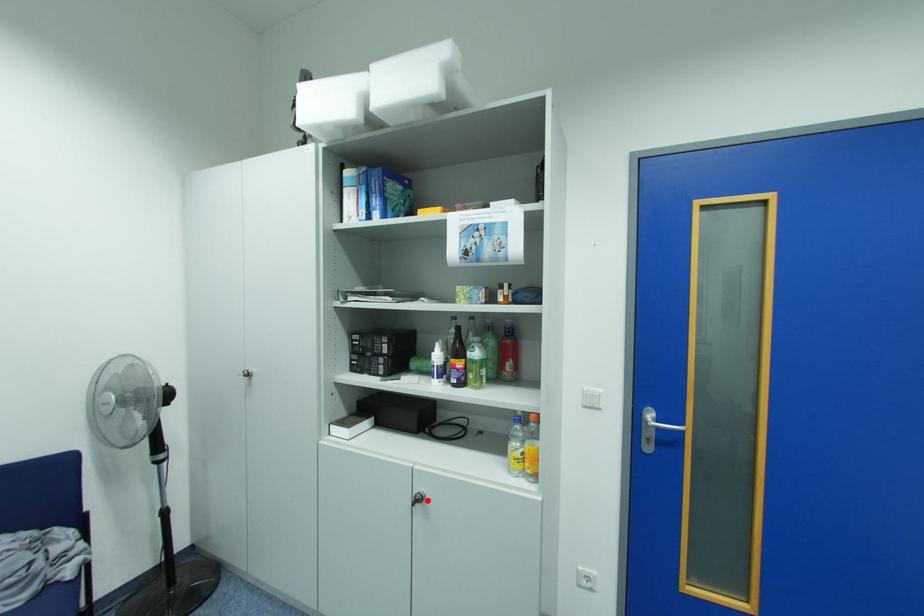
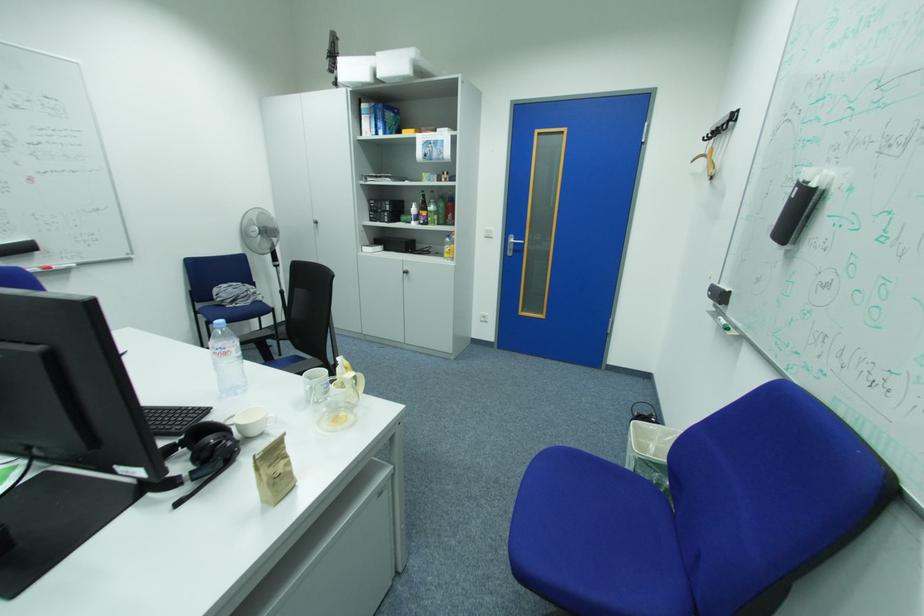
Locate, in the second image, the point that corresponds to the highlighted location in the first image.

(415, 273)